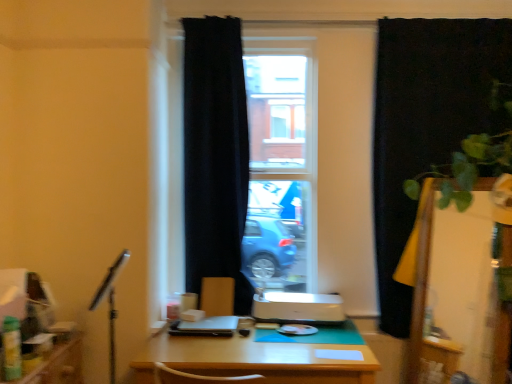
Question: Should I look upward or downward to see black matte curtain at right, the 1th curtain from the right?

Choices:
 (A) up
 (B) down

Answer: (A)

Question: Is black fabric curtain at center, which is counted as the 1th curtain, starting from the left, outside of satin black laptop at center?

Choices:
 (A) yes
 (B) no

Answer: (A)

Question: Does black fabric curtain at center, which is counted as the 1th curtain, starting from the left, turn towards satin black laptop at center?

Choices:
 (A) no
 (B) yes

Answer: (B)

Question: Does black fabric curtain at center, which is the 2th curtain from right to left, have a smaller size compared to satin black laptop at center?

Choices:
 (A) no
 (B) yes

Answer: (A)

Question: Is black fabric curtain at center, which is counted as the 1th curtain, starting from the left, to the right of satin black laptop at center from the viewer's perspective?

Choices:
 (A) no
 (B) yes

Answer: (B)

Question: Would you consider black fabric curtain at center, which is counted as the 1th curtain, starting from the left, to be distant from satin black laptop at center?

Choices:
 (A) yes
 (B) no

Answer: (B)

Question: Does black fabric curtain at center, which is the 2th curtain from right to left, lie in front of satin black laptop at center?

Choices:
 (A) yes
 (B) no

Answer: (B)

Question: Considering the relative sizes of transparent glass screen door at right and black matte curtain at right, arranged as the 2th curtain when viewed from the left, in the image provided, is transparent glass screen door at right shorter than black matte curtain at right, arranged as the 2th curtain when viewed from the left,?

Choices:
 (A) no
 (B) yes

Answer: (B)

Question: Does transparent glass screen door at right have a smaller size compared to black matte curtain at right, arranged as the 2th curtain when viewed from the left?

Choices:
 (A) no
 (B) yes

Answer: (B)

Question: Considering the relative positions of transparent glass screen door at right and black matte curtain at right, arranged as the 2th curtain when viewed from the left, in the image provided, is transparent glass screen door at right to the left of black matte curtain at right, arranged as the 2th curtain when viewed from the left, from the viewer's perspective?

Choices:
 (A) yes
 (B) no

Answer: (A)

Question: Is transparent glass screen door at right to the right of black matte curtain at right, the 1th curtain from the right, from the viewer's perspective?

Choices:
 (A) yes
 (B) no

Answer: (B)

Question: Would you say transparent glass screen door at right is a long distance from black matte curtain at right, arranged as the 2th curtain when viewed from the left?

Choices:
 (A) yes
 (B) no

Answer: (B)

Question: From a real-world perspective, is transparent glass screen door at right beneath black matte curtain at right, arranged as the 2th curtain when viewed from the left?

Choices:
 (A) yes
 (B) no

Answer: (A)

Question: Does black fabric curtain at center, which is the 2th curtain from right to left, appear on the left side of wooden desk at center?

Choices:
 (A) no
 (B) yes

Answer: (B)